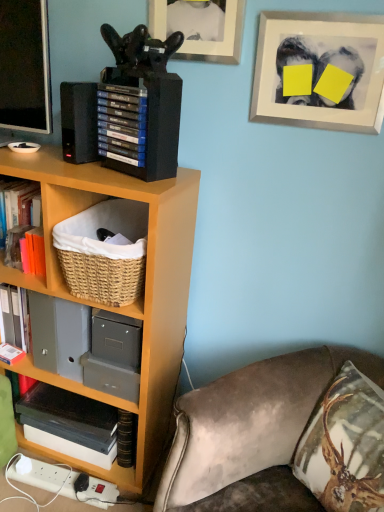
At what (x,y) coordinates should I click in order to perform the action: click on vacant area that lies in front of blue matte game cases at upper left. Please return your answer as a coordinate pair (x, y). The width and height of the screenshot is (384, 512). Looking at the image, I should click on (131, 181).